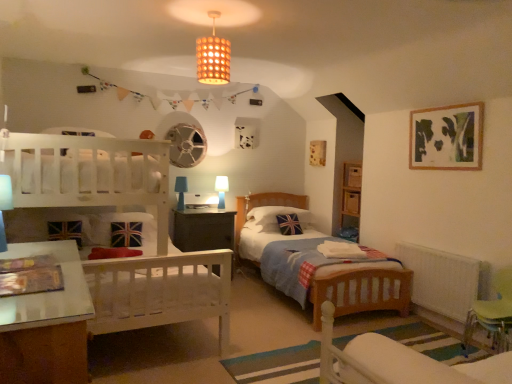
Find the location of a particular element. free point above wooden picture frame at upper right (from a real-world perspective) is located at coordinates [x=440, y=107].